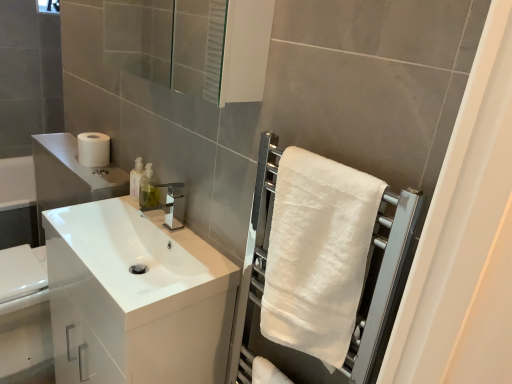
Question: Is transparent glass mirror at upper center closer to camera compared to white soft towel at right?

Choices:
 (A) no
 (B) yes

Answer: (A)

Question: From a real-world perspective, is transparent glass mirror at upper center physically above white soft towel at right?

Choices:
 (A) no
 (B) yes

Answer: (B)

Question: Does transparent glass mirror at upper center touch white soft towel at right?

Choices:
 (A) yes
 (B) no

Answer: (B)

Question: Is transparent glass mirror at upper center taller than white soft towel at right?

Choices:
 (A) yes
 (B) no

Answer: (B)

Question: Is transparent glass mirror at upper center smaller than white soft towel at right?

Choices:
 (A) yes
 (B) no

Answer: (B)

Question: Considering the positions of white soft towel at right and white glossy cabinet at left in the image, is white soft towel at right taller or shorter than white glossy cabinet at left?

Choices:
 (A) tall
 (B) short

Answer: (B)

Question: In the image, is white soft towel at right positioned in front of or behind white glossy cabinet at left?

Choices:
 (A) front
 (B) behind

Answer: (A)

Question: Is white soft towel at right bigger or smaller than white glossy cabinet at left?

Choices:
 (A) big
 (B) small

Answer: (B)

Question: Considering the positions of white soft towel at right and white glossy cabinet at left in the image, is white soft towel at right wider or thinner than white glossy cabinet at left?

Choices:
 (A) wide
 (B) thin

Answer: (B)

Question: Is point (94, 148) closer or farther from the camera than point (143, 14)?

Choices:
 (A) closer
 (B) farther

Answer: (A)

Question: From the image's perspective, is white matte toilet paper at left above or below transparent glass mirror at upper center?

Choices:
 (A) above
 (B) below

Answer: (B)

Question: Which is correct: white matte toilet paper at left is inside transparent glass mirror at upper center, or outside of it?

Choices:
 (A) inside
 (B) outside

Answer: (B)

Question: From a real-world perspective, relative to transparent glass mirror at upper center, is white matte toilet paper at left vertically above or below?

Choices:
 (A) below
 (B) above

Answer: (A)

Question: From their relative heights in the image, would you say white glossy cabinet at left is taller or shorter than transparent glass mirror at upper center?

Choices:
 (A) short
 (B) tall

Answer: (B)

Question: In terms of size, does white glossy cabinet at left appear bigger or smaller than transparent glass mirror at upper center?

Choices:
 (A) small
 (B) big

Answer: (B)